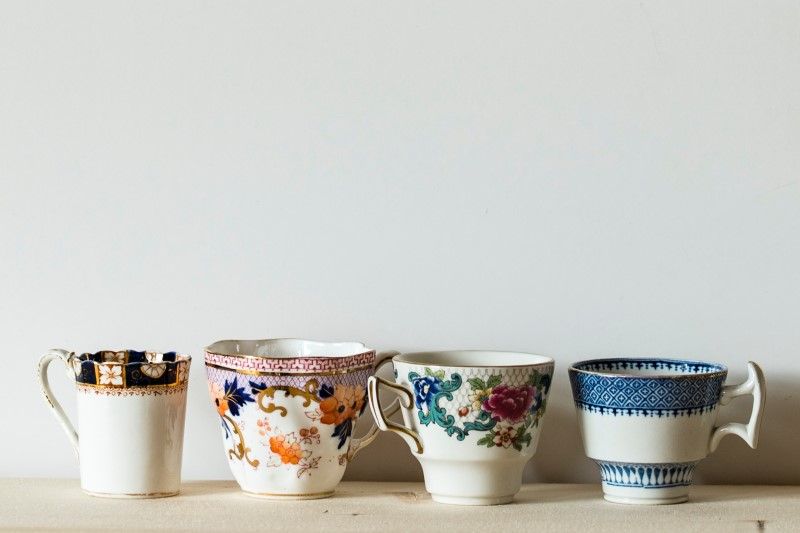
This screenshot has width=800, height=533. What are the coordinates of `handles of the teacups` in the screenshot? It's located at (42, 367), (370, 432), (374, 398), (760, 399).